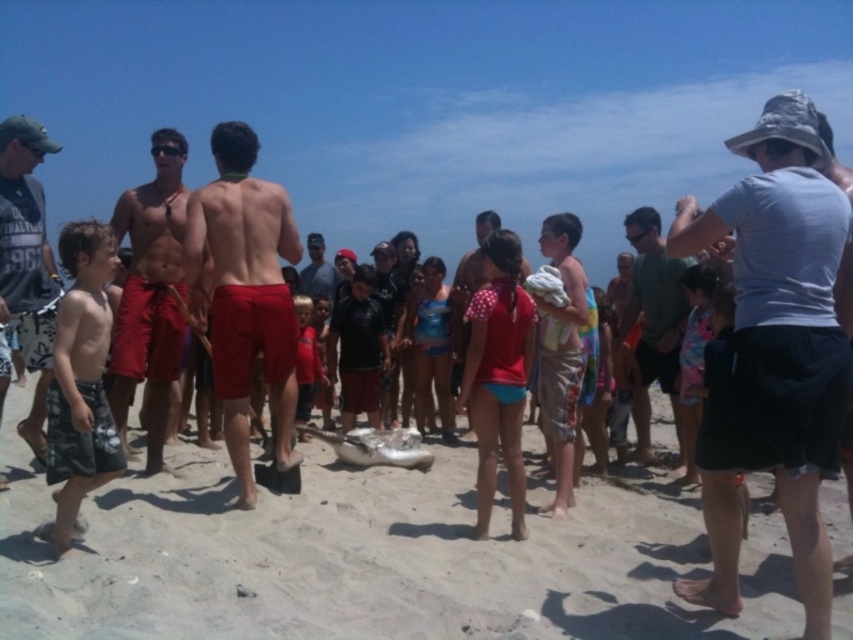
From the picture: Can you confirm if shiny red shorts at center is positioned to the right of gray cotton shirt at right?

No, shiny red shorts at center is not to the right of gray cotton shirt at right.

Is shiny red shorts at center taller than gray cotton shirt at right?

Yes, shiny red shorts at center is taller than gray cotton shirt at right.

You are a GUI agent. You are given a task and a screenshot of the screen. Output one action in this format:
    pyautogui.click(x=<x>, y=<y>)
    Task: Click on the shiny red shorts at center
    The width and height of the screenshot is (853, 640).
    Given the screenshot: What is the action you would take?
    pyautogui.click(x=149, y=294)

Which is above, light blue t-shirt at center or shiny red shorts at center?

light blue t-shirt at center is higher up.

Locate an element on the screen. This screenshot has height=640, width=853. light blue t-shirt at center is located at coordinates (775, 349).

Find the location of a particular element. Image resolution: width=853 pixels, height=640 pixels. light blue t-shirt at center is located at coordinates (775, 349).

Who is taller, shiny red shorts at center or matte gray t-shirt at left?

shiny red shorts at center is taller.

Measure the distance between point (122,214) and camera.

Point (122,214) and camera are 6.62 meters apart.

Between point (113, 339) and point (33, 246), which one is positioned in front?

Point (33, 246) is more forward.

Locate an element on the screen. Image resolution: width=853 pixels, height=640 pixels. shiny red shorts at center is located at coordinates (149, 294).